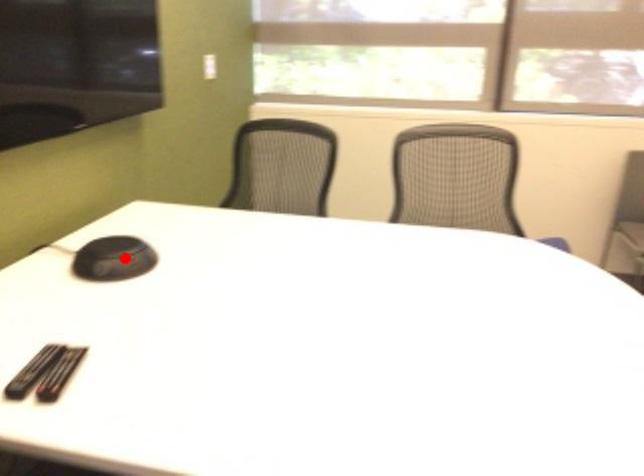
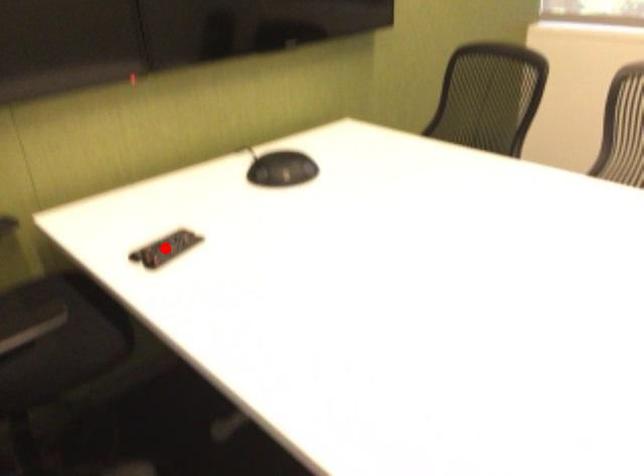
I am providing you with two images of the same scene from different viewpoints. A red point is marked on the first image and another point is marked on the second image. Are the points marked in image1 and image2 representing the same 3D position?

No